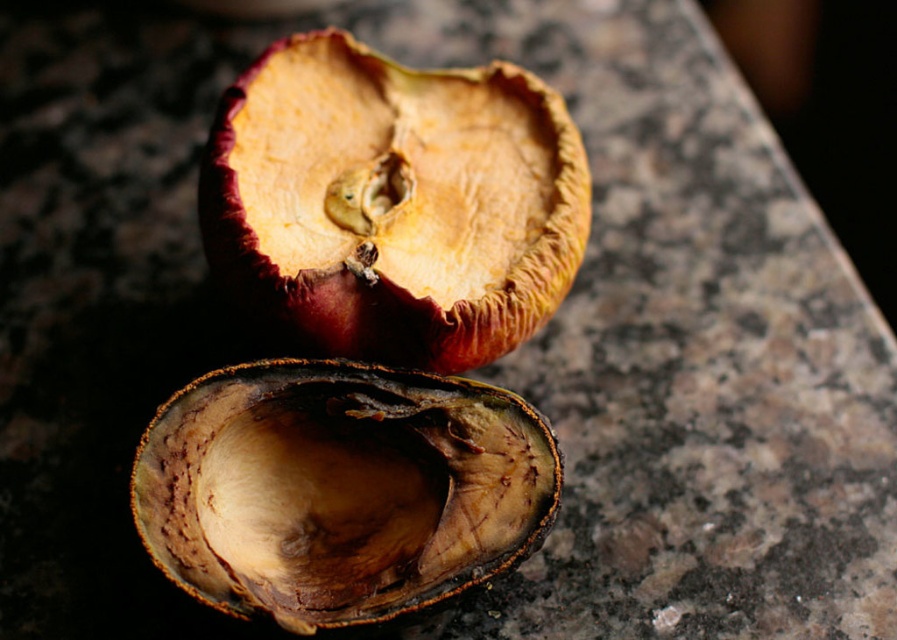
You are arranging objects on a countertop and need to place a small bowl between the brown leathery apple at upper center and the brown leathery shell at center. Based on their positions, where should you place the bowl?

Since the brown leathery apple at upper center is to the right of the brown leathery shell at center, you should place the bowl to the left of the brown leathery apple at upper center and to the right of the brown leathery shell at center to position it between them.

You are trying to fit both the brown leathery apple at upper center and the brown leathery shell at center into a storage container that can only accommodate items up to the width of the wider object. Which object determines the maximum width the container must have?

The brown leathery shell at center has a greater width than the brown leathery apple at upper center, so the container must be at least as wide as the brown leathery shell at center to accommodate both items.

You are a botanist examining a dried fruit sample on a granite countertop. You notice two halves of the fruit, one overlapping the other. There is a specific point labeled as point (393, 204) in your analysis. Which fruit part does this point belong to?

The point (393, 204) corresponds to the brown leathery apple at upper center.